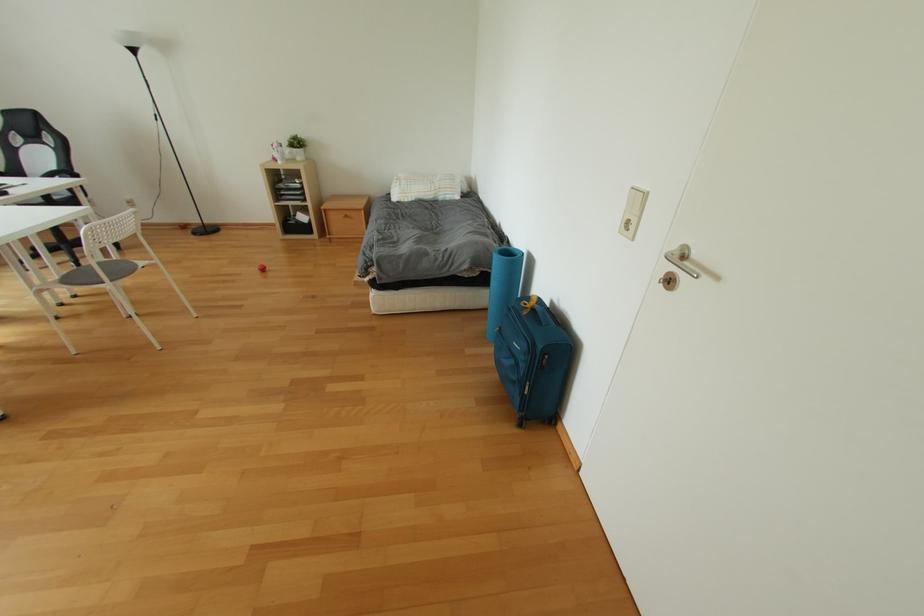
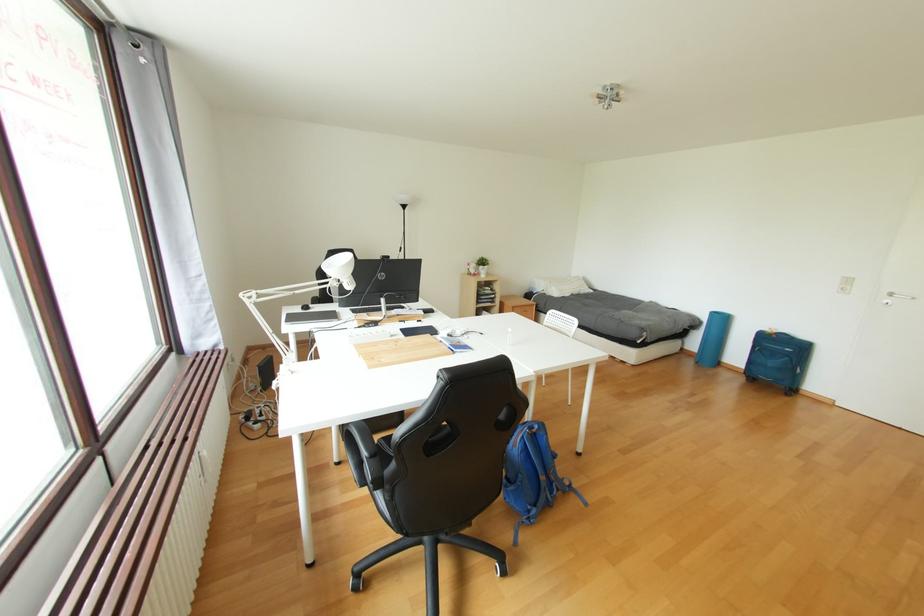
Question: The images are taken continuously from a first-person perspective. In which direction are you moving?

Choices:
 (A) Left
 (B) Right
 (C) Forward
 (D) Backward

Answer: (A)